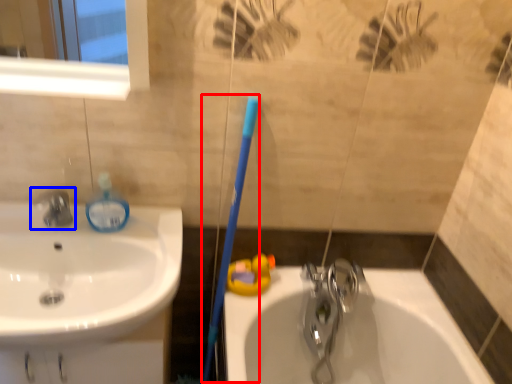
Question: Which of the following is the farthest to the observer, toothbrush (highlighted by a red box) or tap (highlighted by a blue box)?

Choices:
 (A) toothbrush
 (B) tap

Answer: (B)